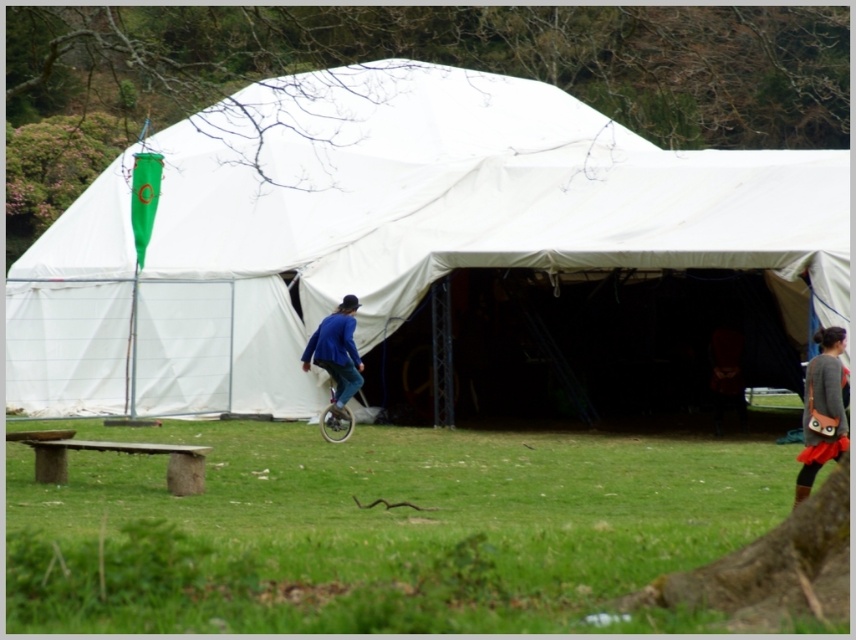
Which of these two, blue fabric unicycle at center or metallic silver unicycle at center, stands shorter?

metallic silver unicycle at center is shorter.

Identify the location of blue fabric unicycle at center. The height and width of the screenshot is (640, 856). (336, 353).

Who is positioned more to the left, green grass at lower center or blue fabric unicycle at center?

From the viewer's perspective, blue fabric unicycle at center appears more on the left side.

The height and width of the screenshot is (640, 856). What do you see at coordinates (378, 531) in the screenshot? I see `green grass at lower center` at bounding box center [378, 531].

Find the location of a particular element. The image size is (856, 640). green grass at lower center is located at coordinates (378, 531).

Is green grass at lower center bigger than gray fabric skirt at right?

Indeed, green grass at lower center has a larger size compared to gray fabric skirt at right.

Is green grass at lower center shorter than gray fabric skirt at right?

Correct, green grass at lower center is not as tall as gray fabric skirt at right.

This screenshot has width=856, height=640. Find the location of `green grass at lower center`. green grass at lower center is located at coordinates (378, 531).